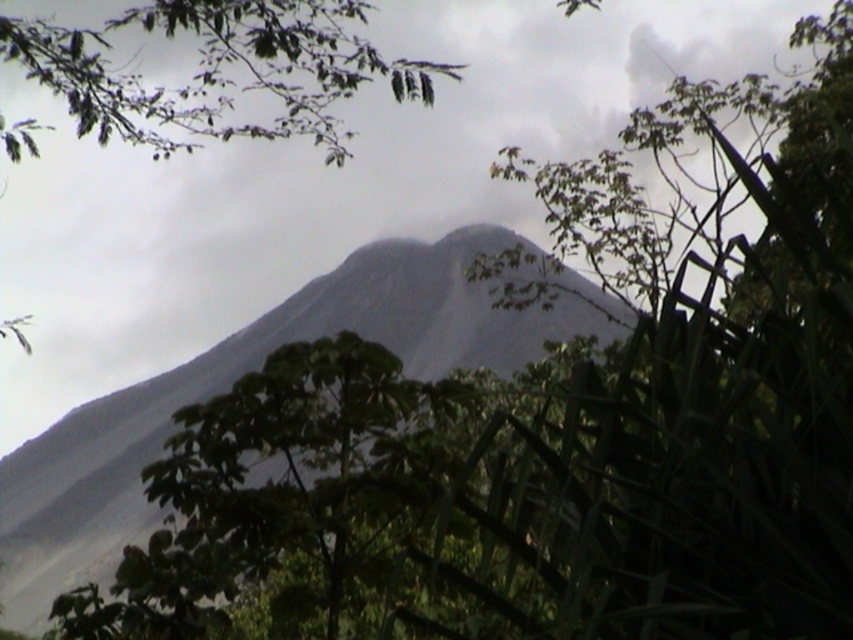
You are a hiker planning to reach the summit of the mountain in the image. You notice a point marked at coordinates point [229,387]. Based on the description, is this point located on the mountain or in the surrounding vegetation?

The point [229,387] is on the gray rocky mountain at center, so it is located on the mountain.